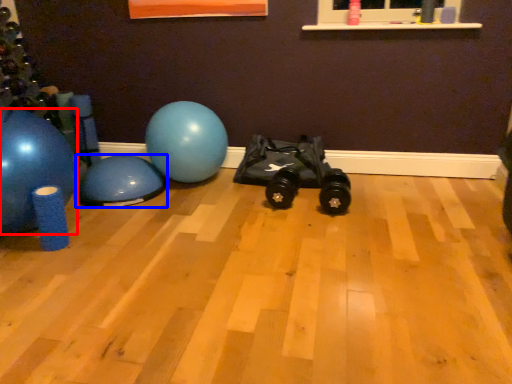
Question: Which object is further to the camera taking this photo, ball (highlighted by a red box) or ball (highlighted by a blue box)?

Choices:
 (A) ball
 (B) ball

Answer: (B)